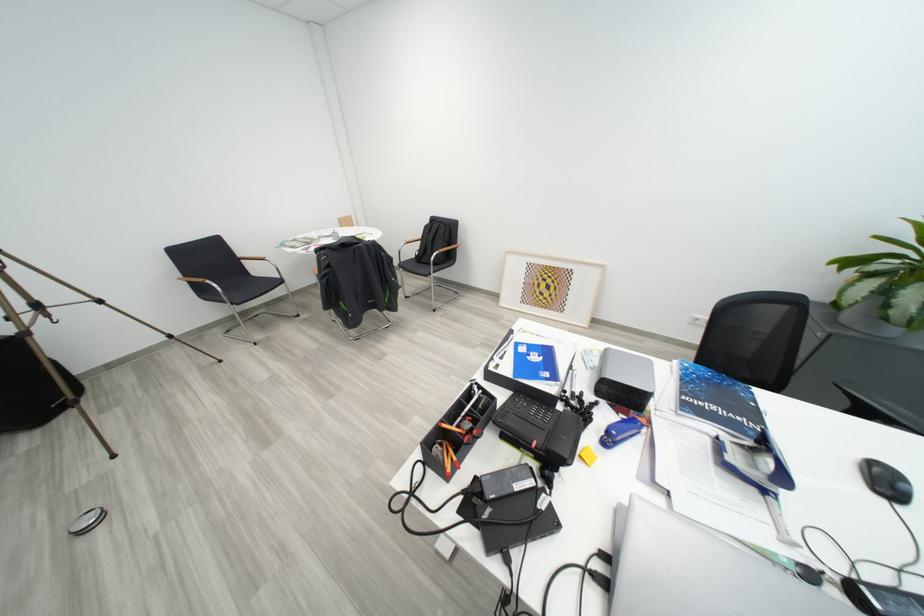
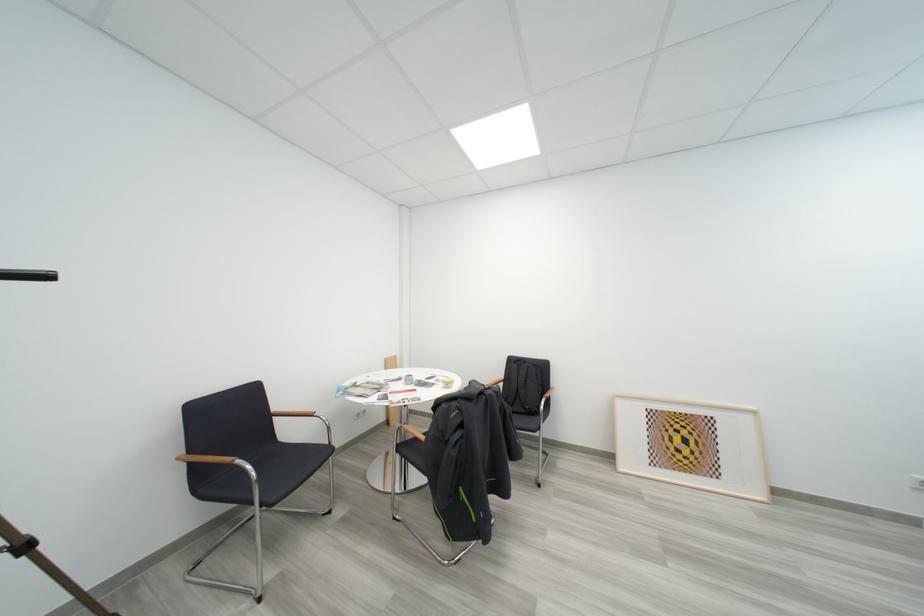
The point at (216,284) is marked in the first image. Where is the corresponding point in the second image?

(247, 464)